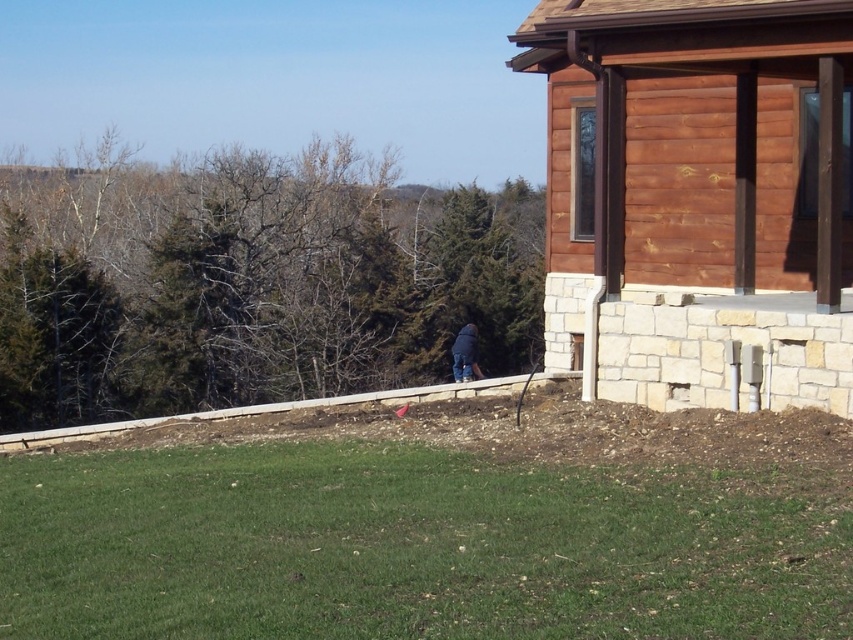
Between point (410, 618) and point (456, 337), which one is positioned behind?

Positioned behind is point (456, 337).

Is point (294, 468) positioned in front of point (469, 324)?

Yes, it is.

Locate an element on the screen. This screenshot has width=853, height=640. green grass at lower center is located at coordinates (412, 547).